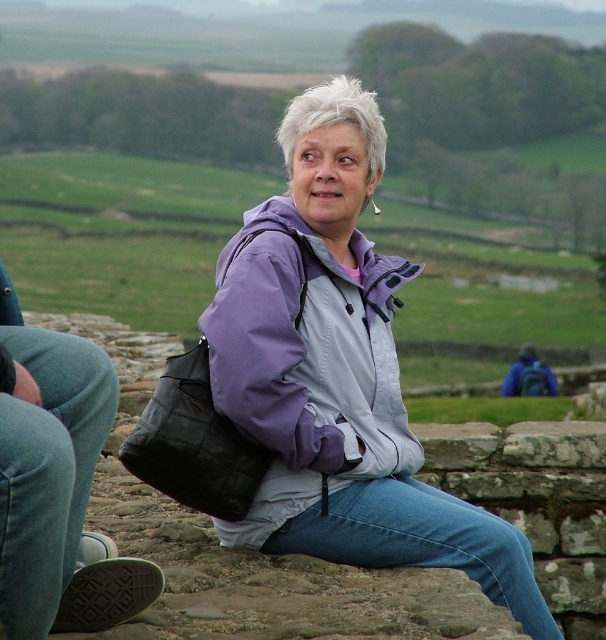
Is purple matte jacket at center to the right of purple softshell jacket at center from the viewer's perspective?

Indeed, purple matte jacket at center is positioned on the right side of purple softshell jacket at center.

Between point (458, 525) and point (318, 493), which one is positioned behind?

Point (318, 493)

Is point (494, 566) less distant than point (204, 312)?

Yes, it is in front of point (204, 312).

Locate an element on the screen. purple matte jacket at center is located at coordinates 339,374.